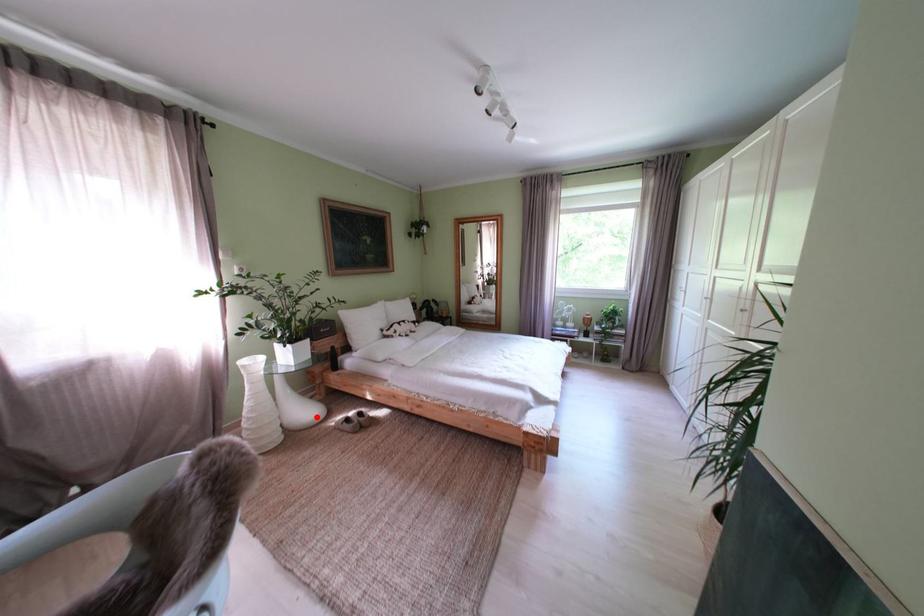
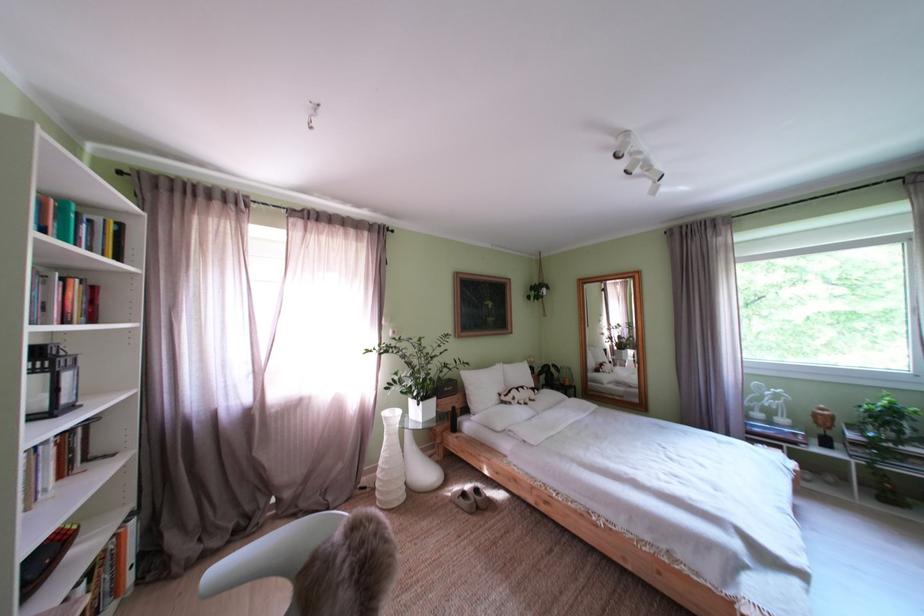
Question: A red point is marked in image1. In image2, is the corresponding 3D point closer to the camera or farther? Reply with the corresponding letter.

Choices:
 (A) The corresponding 3D point is closer.
 (B) The corresponding 3D point is farther.

Answer: (B)